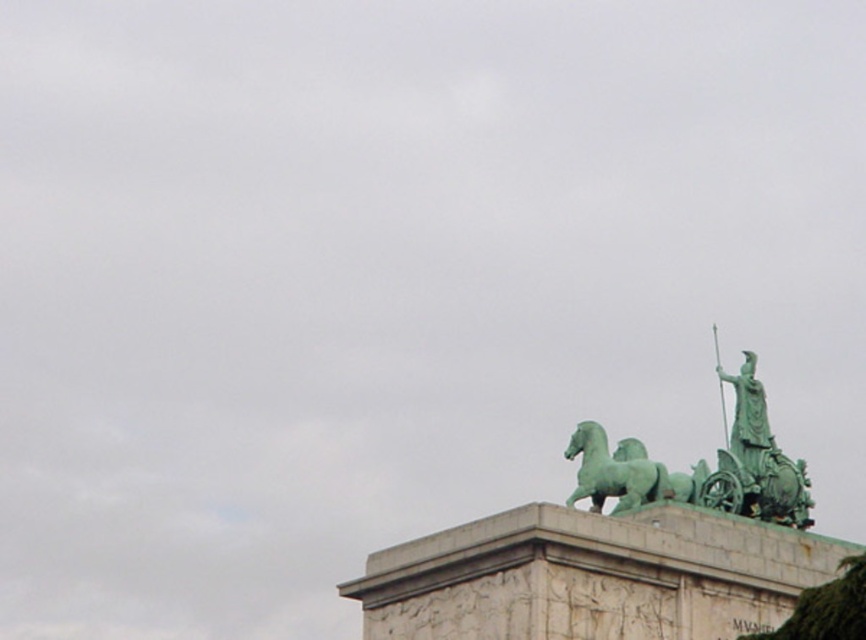
You are an art conservator assessing the monument. You notice two chariots in the image. Which chariot, the green polished metal chariot at upper right or the green patinated bronze chariot at upper right, has a larger width?

The green polished metal chariot at upper right might be wider than the green patinated bronze chariot at upper right, so the green polished metal chariot at upper right could have a larger width.

You are standing at the base of the monument and looking upward. There are two points marked on the structure. The first point is at coordinates point (x=593, y=468) and the second is at point (x=845, y=595). Which point is closer to your current position?

Point (x=845, y=595) is closer to your current position because it is in front of point (x=593, y=468).